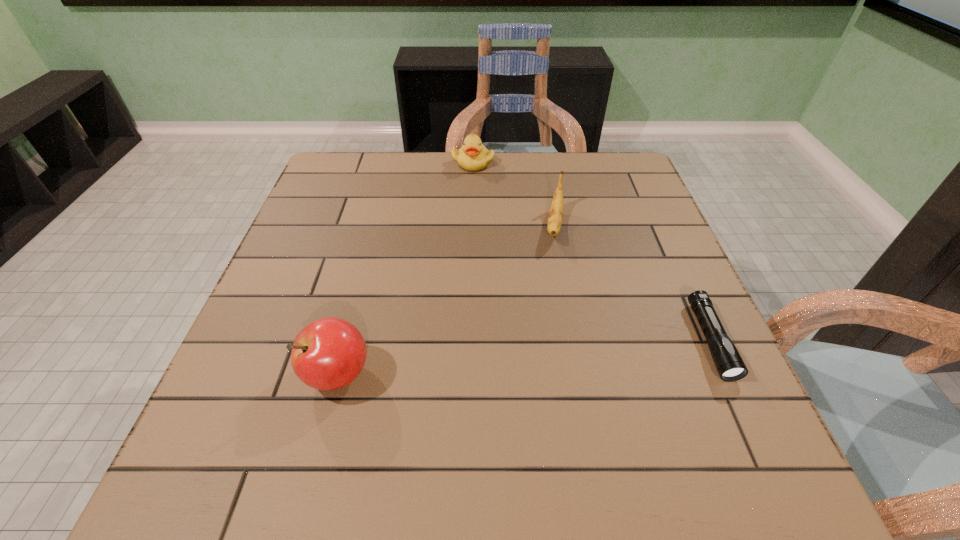
The image size is (960, 540). Find the location of `the leftmost object`. the leftmost object is located at coordinates (329, 353).

This screenshot has height=540, width=960. Identify the location of apple. (329, 353).

Where is `the shortest object`? the shortest object is located at coordinates (730, 366).

The height and width of the screenshot is (540, 960). Find the location of `flashlight`. flashlight is located at coordinates (730, 366).

At what (x,y) coordinates should I click in order to perform the action: click on the third nearest object. Please return your answer as a coordinate pair (x, y). Looking at the image, I should click on (556, 210).

Where is `the third object from left to right`? This screenshot has height=540, width=960. the third object from left to right is located at coordinates (556, 210).

Identify the location of the farthest object. Image resolution: width=960 pixels, height=540 pixels. (473, 156).

You are a GUI agent. You are given a task and a screenshot of the screen. Output one action in this format:
    pyautogui.click(x=<x>, y=<y>)
    Task: Click on the duckling
    
    Given the screenshot: What is the action you would take?
    pyautogui.click(x=473, y=156)

Where is `vacant space situated 0.360m on the right of the leftmost object`? vacant space situated 0.360m on the right of the leftmost object is located at coordinates (571, 374).

I want to click on free space located 0.060m at the lens end of the shortest object, so click(x=743, y=413).